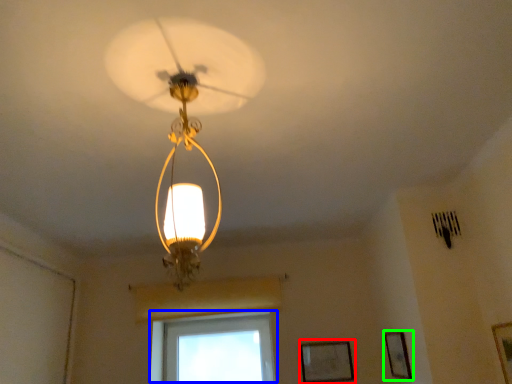
Question: Which object is positioned farthest from picture frame (highlighted by a red box)? Select from window (highlighted by a blue box) and picture frame (highlighted by a green box).

Choices:
 (A) window
 (B) picture frame

Answer: (A)